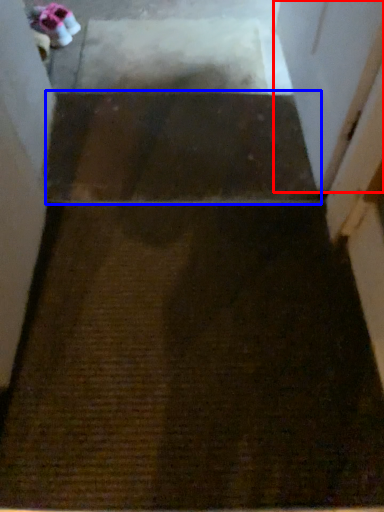
Question: Which point is further to the camera, screen door (highlighted by a red box) or stairwell (highlighted by a blue box)?

Choices:
 (A) screen door
 (B) stairwell

Answer: (B)